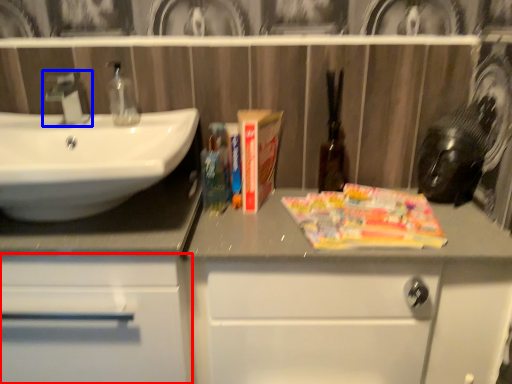
Question: Which of the following is the closest to the observer, bathroom cabinet (highlighted by a red box) or tap (highlighted by a blue box)?

Choices:
 (A) bathroom cabinet
 (B) tap

Answer: (A)